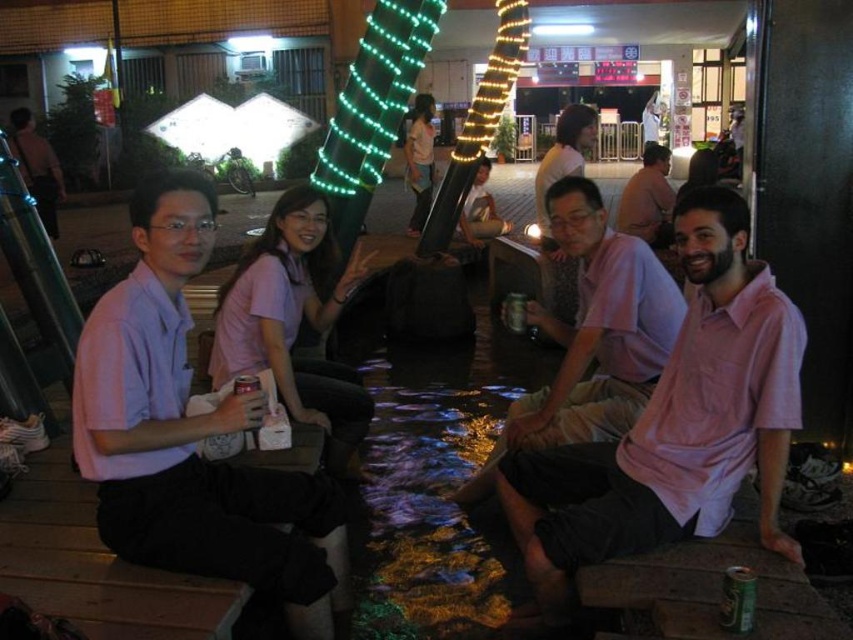
You are standing at the center of the scene. Which direction should you look to see the matte pink shirt at left?

The matte pink shirt at left is located at point (190, 433), which is to the left side of the scene. Therefore, you should look to your left to see it.

You are a photographer trying to capture the pink cotton shirt at center and the green metallic can at lower right in the same frame. Based on their positions, which object should you adjust your camera to focus on first to ensure both are in the shot?

The pink cotton shirt at center is to the left of the green metallic can at lower right, so you should focus on the pink cotton shirt at center first to ensure both are in the frame.